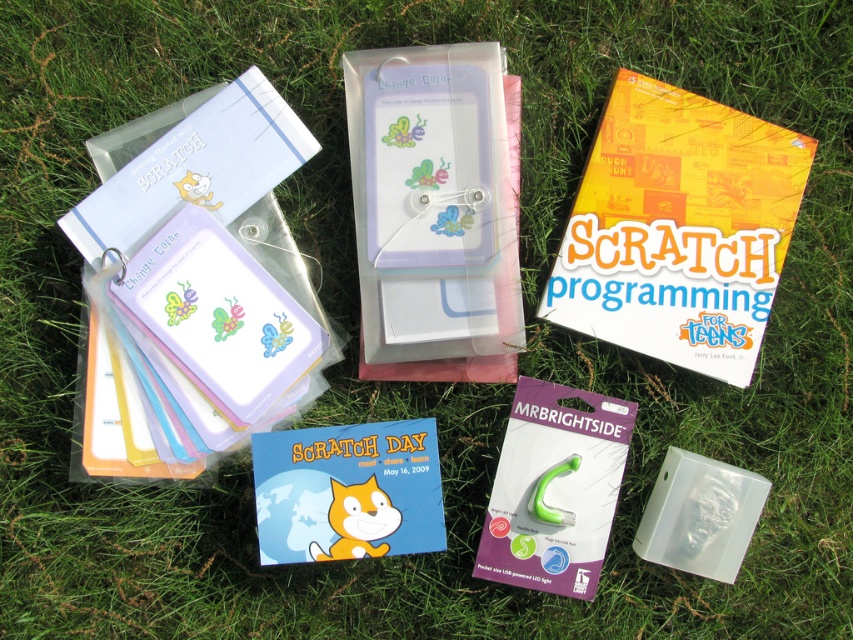
You are a student trying to reach both the yellow paper book at upper right and the pastel paper notepad at upper left. Which item will you need to move first to get to the other?

You will need to move the yellow paper book at upper right first because it is closer to you and blocking the pastel paper notepad at upper left, which is further away.

Consider the image. You are looking at the items on the grassy surface. There are two points marked as point 1 at coordinates point [258,365] and point 2 at coordinates point [512,520]. Which point is closer to you?

Point [258,365] is closer to you because it is further to the camera than point [512,520].

You are organizing items on a table and need to place the yellow paper book at upper right and the green plastic mrbrightside at center. According to the layout, which item should be placed to the right side of the table?

The yellow paper book at upper right should be placed to the right side of the table because it is to the right of the green plastic mrbrightside at center.